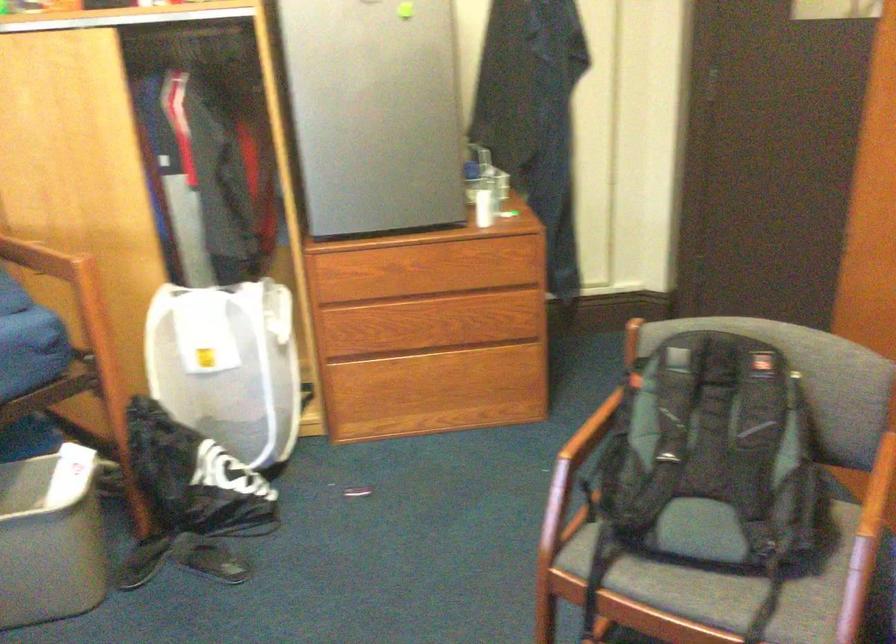
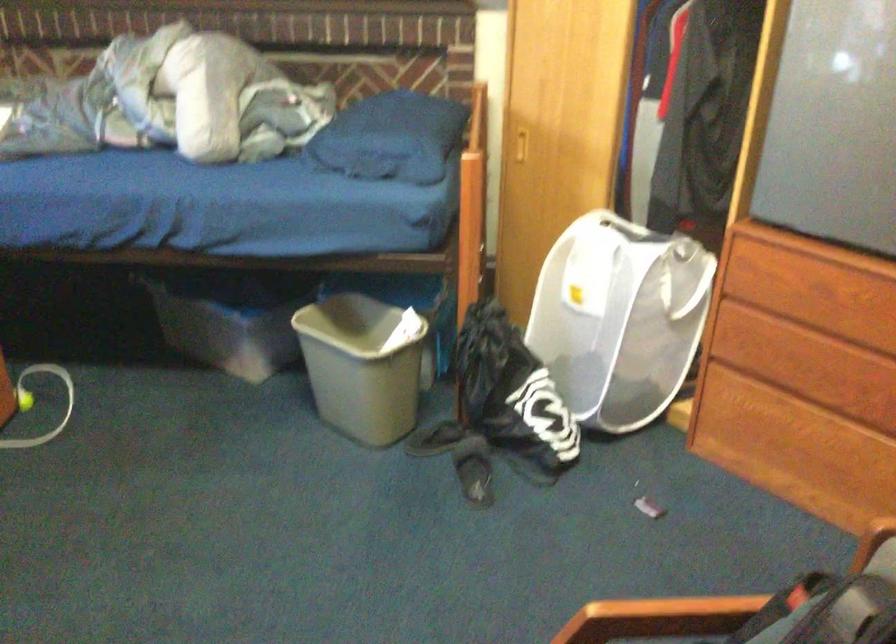
In the second image, find the point that corresponds to pixel 175 296 in the first image.

(600, 225)